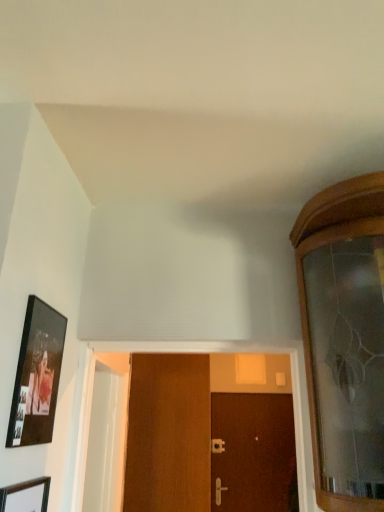
Where is `matte black picture frame at left, acting as the first picture frame starting from the top`? The image size is (384, 512). matte black picture frame at left, acting as the first picture frame starting from the top is located at coordinates (37, 376).

Where is `brown wooden door at center, the 1th door viewed from the right`? This screenshot has width=384, height=512. brown wooden door at center, the 1th door viewed from the right is located at coordinates (254, 452).

What do you see at coordinates (217, 446) in the screenshot? Image resolution: width=384 pixels, height=512 pixels. I see `silver metallic door handle at center, the first door handle positioned from the top` at bounding box center [217, 446].

How much space does wooden picture frame at lower left, placed as the first picture frame when sorted from bottom to top, occupy vertically?

wooden picture frame at lower left, placed as the first picture frame when sorted from bottom to top, is 16.22 inches in height.

Identify the location of wooden door at center, which ranks as the second door in right-to-left order. This screenshot has height=512, width=384. (168, 434).

You are a GUI agent. You are given a task and a screenshot of the screen. Output one action in this format:
    pyautogui.click(x=<x>, y=<y>)
    Task: Click on the matte black picture frame at left, which ranks as the 2th picture frame in bottom-to-top order
    This screenshot has height=512, width=384.
    Given the screenshot: What is the action you would take?
    pyautogui.click(x=37, y=376)

In the image, there is a satin gold door handle at center, arranged as the 1th door handle when ordered from the bottom. What are the coordinates of `door handle above it (from the image's perspective)` in the screenshot? It's located at (217, 446).

Which point is more distant from viewer, (213, 443) or (218, 477)?

Positioned behind is point (213, 443).

Is silver metallic door handle at center, the first door handle positioned from the top, taller or shorter than satin gold door handle at center, which is the second door handle from top to bottom?

Considering their sizes, silver metallic door handle at center, the first door handle positioned from the top, has less height than satin gold door handle at center, which is the second door handle from top to bottom.

From the picture: Is silver metallic door handle at center, acting as the second door handle starting from the front, directly adjacent to satin gold door handle at center, which is the 1th door handle from front to back?

silver metallic door handle at center, acting as the second door handle starting from the front, and satin gold door handle at center, which is the 1th door handle from front to back, are not in contact.

In terms of width, does wooden door at center, acting as the 2th door starting from the bottom, look wider or thinner when compared to matte black picture frame at left, acting as the first picture frame starting from the top?

Clearly, wooden door at center, acting as the 2th door starting from the bottom, has more width compared to matte black picture frame at left, acting as the first picture frame starting from the top.

Between wooden door at center, acting as the 2th door starting from the bottom, and matte black picture frame at left, which ranks as the 2th picture frame in bottom-to-top order, which one has more height?

wooden door at center, acting as the 2th door starting from the bottom, is taller.

From the picture: Between wooden door at center, acting as the 2th door starting from the bottom, and matte black picture frame at left, which ranks as the 2th picture frame in bottom-to-top order, which one appears on the right side from the viewer's perspective?

From the viewer's perspective, wooden door at center, acting as the 2th door starting from the bottom, appears more on the right side.

Measure the distance between wooden door at center, acting as the 2th door starting from the bottom, and matte black picture frame at left, which ranks as the 2th picture frame in bottom-to-top order.

wooden door at center, acting as the 2th door starting from the bottom, is 4.56 feet away from matte black picture frame at left, which ranks as the 2th picture frame in bottom-to-top order.

From the image's perspective, would you say satin gold door handle at center, arranged as the 1th door handle when ordered from the bottom, is shown under silver metallic door handle at center, acting as the second door handle starting from the front?

Yes.

Considering the positions of points (216, 487) and (217, 450), is point (216, 487) closer to camera compared to point (217, 450)?

Yes, it is in front of point (217, 450).

Is satin gold door handle at center, arranged as the 1th door handle when ordered from the bottom, smaller than silver metallic door handle at center, the second door handle ordered from the bottom?

Incorrect, satin gold door handle at center, arranged as the 1th door handle when ordered from the bottom, is not smaller in size than silver metallic door handle at center, the second door handle ordered from the bottom.

Can you confirm if satin gold door handle at center, which is the 1th door handle from front to back, is positioned to the right of silver metallic door handle at center, the first door handle positioned from the top?

Incorrect, satin gold door handle at center, which is the 1th door handle from front to back, is not on the right side of silver metallic door handle at center, the first door handle positioned from the top.

Considering the relative positions of satin gold door handle at center, acting as the 2th door handle starting from the back, and matte black picture frame at left, acting as the first picture frame starting from the top, in the image provided, is satin gold door handle at center, acting as the 2th door handle starting from the back, to the left of matte black picture frame at left, acting as the first picture frame starting from the top, from the viewer's perspective?

Incorrect, satin gold door handle at center, acting as the 2th door handle starting from the back, is not on the left side of matte black picture frame at left, acting as the first picture frame starting from the top.

From the image's perspective, is satin gold door handle at center, acting as the 2th door handle starting from the back, above matte black picture frame at left, acting as the first picture frame starting from the top?

Actually, satin gold door handle at center, acting as the 2th door handle starting from the back, appears below matte black picture frame at left, acting as the first picture frame starting from the top, in the image.

Starting from the satin gold door handle at center, acting as the 2th door handle starting from the back, which picture frame is the 1st one to the left? Please provide its 2D coordinates.

[(37, 376)]

From a real-world perspective, who is located lower, brown wooden door at center, which is counted as the second door, starting from the front, or satin gold door handle at center, acting as the 2th door handle starting from the back?

satin gold door handle at center, acting as the 2th door handle starting from the back, is physically lower.

Find the location of a particular element. The image size is (384, 512). door handle in front of the brown wooden door at center, arranged as the 1th door when viewed from the back is located at coordinates (219, 490).

Between brown wooden door at center, the 1th door positioned from the bottom, and satin gold door handle at center, arranged as the 1th door handle when ordered from the bottom, which one appears on the left side from the viewer's perspective?

From the viewer's perspective, satin gold door handle at center, arranged as the 1th door handle when ordered from the bottom, appears more on the left side.

Would you say satin gold door handle at center, arranged as the 1th door handle when ordered from the bottom, is part of brown wooden door at center, placed as the second door when sorted from top to bottom,'s contents?

No, satin gold door handle at center, arranged as the 1th door handle when ordered from the bottom, is not a part of brown wooden door at center, placed as the second door when sorted from top to bottom.

From the image's perspective, who appears lower, wooden door at center, which ranks as the second door in right-to-left order, or satin gold door handle at center, which is the second door handle from top to bottom?

satin gold door handle at center, which is the second door handle from top to bottom, is shown below in the image.

How far apart are wooden door at center, which is the first door in top-to-bottom order, and satin gold door handle at center, arranged as the 1th door handle when ordered from the bottom?

They are 2.06 meters apart.

Does wooden door at center, which ranks as the second door in right-to-left order, have a larger size compared to satin gold door handle at center, which is the second door handle from top to bottom?

Indeed, wooden door at center, which ranks as the second door in right-to-left order, has a larger size compared to satin gold door handle at center, which is the second door handle from top to bottom.

Can you confirm if wooden picture frame at lower left, arranged as the 2th picture frame when viewed from the top, is positioned to the right of satin gold door handle at center, acting as the 2th door handle starting from the back?

In fact, wooden picture frame at lower left, arranged as the 2th picture frame when viewed from the top, is to the left of satin gold door handle at center, acting as the 2th door handle starting from the back.

Does wooden picture frame at lower left, arranged as the 2th picture frame when viewed from the top, lie in front of satin gold door handle at center, which is the 1th door handle from front to back?

Yes, it is.

Where is `the 1st door handle behind the wooden picture frame at lower left, arranged as the 2th picture frame when viewed from the top`? the 1st door handle behind the wooden picture frame at lower left, arranged as the 2th picture frame when viewed from the top is located at coordinates (219, 490).

Could satin gold door handle at center, arranged as the 1th door handle when ordered from the bottom, be considered to be inside wooden picture frame at lower left, placed as the first picture frame when sorted from bottom to top?

No, wooden picture frame at lower left, placed as the first picture frame when sorted from bottom to top, does not contain satin gold door handle at center, arranged as the 1th door handle when ordered from the bottom.

This screenshot has height=512, width=384. Identify the location of door handle beneath the silver metallic door handle at center, the first door handle positioned from the top (from a real-world perspective). (219, 490).

From the image's perspective, which picture frame is the 2nd one above the wooden door at center, placed as the second door when sorted from back to front? Please provide its 2D coordinates.

[(37, 376)]

Based on their spatial positions, is wooden door at center, acting as the 2th door starting from the bottom, or satin gold door handle at center, arranged as the 1th door handle when ordered from the bottom, closer to brown wooden door at center, arranged as the 1th door when viewed from the back?

satin gold door handle at center, arranged as the 1th door handle when ordered from the bottom.

In the scene shown: Considering their positions, is silver metallic door handle at center, which appears as the 1th door handle when viewed from the back, positioned further to matte black picture frame at left, which ranks as the 2th picture frame in bottom-to-top order, than satin gold door handle at center, which is the second door handle from top to bottom?

Among the two, satin gold door handle at center, which is the second door handle from top to bottom, is located further to matte black picture frame at left, which ranks as the 2th picture frame in bottom-to-top order.

Considering their positions, is matte black picture frame at left, which ranks as the 2th picture frame in bottom-to-top order, positioned further to silver metallic door handle at center, the second door handle ordered from the bottom, than brown wooden door at center, arranged as the 1th door when viewed from the back?

matte black picture frame at left, which ranks as the 2th picture frame in bottom-to-top order.

From the image, which object appears to be farther from silver metallic door handle at center, the second door handle ordered from the bottom, wooden picture frame at lower left, arranged as the 2th picture frame when viewed from the top, or satin gold door handle at center, which is the 1th door handle from front to back?

wooden picture frame at lower left, arranged as the 2th picture frame when viewed from the top, is further to silver metallic door handle at center, the second door handle ordered from the bottom.

Based on their spatial positions, is wooden picture frame at lower left, arranged as the 2th picture frame when viewed from the top, or satin gold door handle at center, acting as the 2th door handle starting from the back, further from matte black picture frame at left, acting as the first picture frame starting from the top?

satin gold door handle at center, acting as the 2th door handle starting from the back, lies further to matte black picture frame at left, acting as the first picture frame starting from the top, than the other object.

When comparing their distances from brown wooden door at center, placed as the second door when sorted from top to bottom, does wooden picture frame at lower left, placed as the first picture frame when sorted from bottom to top, or matte black picture frame at left, which ranks as the 2th picture frame in bottom-to-top order, seem closer?

matte black picture frame at left, which ranks as the 2th picture frame in bottom-to-top order, is closer to brown wooden door at center, placed as the second door when sorted from top to bottom.

Estimate the real-world distances between objects in this image. Which object is closer to satin gold door handle at center, arranged as the 1th door handle when ordered from the bottom, brown wooden door at center, which is counted as the second door, starting from the front, or silver metallic door handle at center, acting as the second door handle starting from the front?

silver metallic door handle at center, acting as the second door handle starting from the front, is closer to satin gold door handle at center, arranged as the 1th door handle when ordered from the bottom.

From the image, which object appears to be nearer to satin gold door handle at center, which is the 1th door handle from front to back, brown wooden door at center, which is counted as the second door, starting from the front, or wooden door at center, acting as the 2th door starting from the bottom?

brown wooden door at center, which is counted as the second door, starting from the front, is positioned closer to the anchor satin gold door handle at center, which is the 1th door handle from front to back.

Locate an element on the screen. picture frame positioned between wooden picture frame at lower left, placed as the first picture frame when sorted from bottom to top, and wooden door at center, acting as the 2th door starting from the bottom, from near to far is located at coordinates (37, 376).

Find the location of a particular element. Image resolution: width=384 pixels, height=512 pixels. picture frame between wooden picture frame at lower left, arranged as the 2th picture frame when viewed from the top, and brown wooden door at center, arranged as the 1th door when viewed from the back, along the z-axis is located at coordinates (37, 376).

At what (x,y) coordinates should I click in order to perform the action: click on door located between matte black picture frame at left, which ranks as the 2th picture frame in bottom-to-top order, and brown wooden door at center, which is counted as the second door, starting from the front, in the depth direction. Please return your answer as a coordinate pair (x, y). Looking at the image, I should click on (168, 434).

The image size is (384, 512). Identify the location of door handle between matte black picture frame at left, which ranks as the 2th picture frame in bottom-to-top order, and brown wooden door at center, the 1th door positioned from the bottom, along the z-axis. (219, 490).